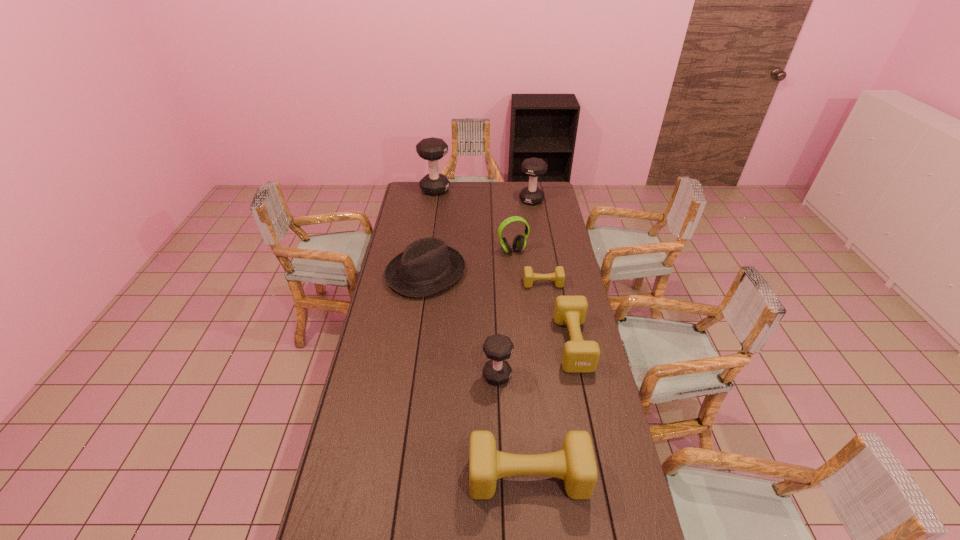
Find the location of a particular element. This screenshot has width=960, height=540. the second closest gray dumbbell to the leftmost dumbbell is located at coordinates (498, 348).

Identify the location of olive dumbbell that can be found as the closest to the second biggest gray dumbbell. This screenshot has height=540, width=960. (558, 276).

Select which olive dumbbell appears as the closest to the second nearest olive dumbbell. Please provide its 2D coordinates. Your answer should be formatted as a tuple, i.e. [(x, y)], where the tuple contains the x and y coordinates of a point satisfying the conditions above.

[(558, 276)]